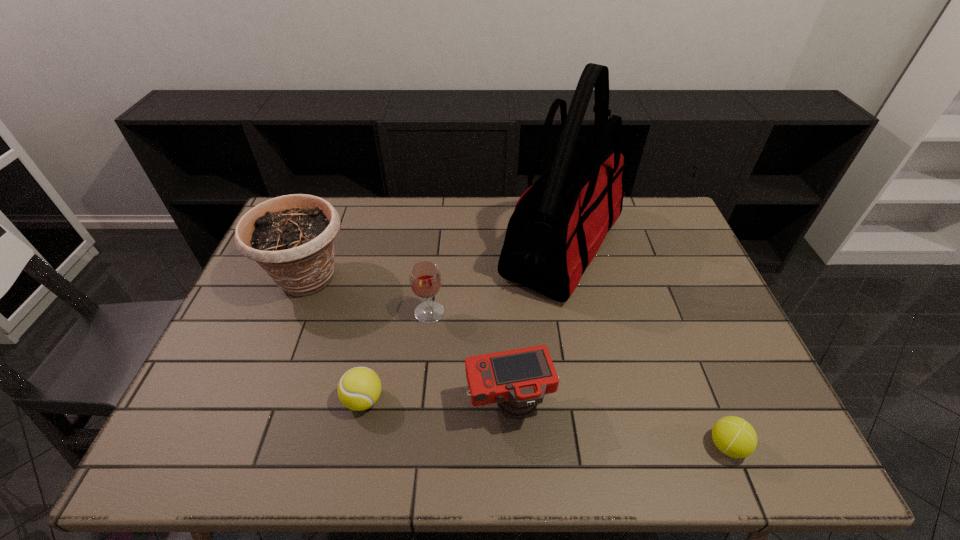
Find the location of `free point that satisfies the following two spatial constraints: 1. on the front side of the shortest object; 2. on the left side of the camera`. free point that satisfies the following two spatial constraints: 1. on the front side of the shortest object; 2. on the left side of the camera is located at coordinates (512, 446).